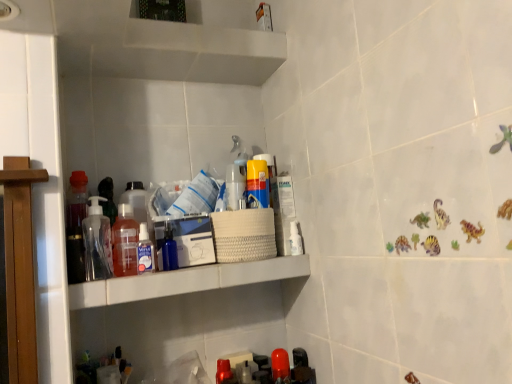
What are the coordinates of `free location to the right of transparent plastic spray bottle at upper center, the 1th toiletry when ordered from left to right` in the screenshot? It's located at (204, 266).